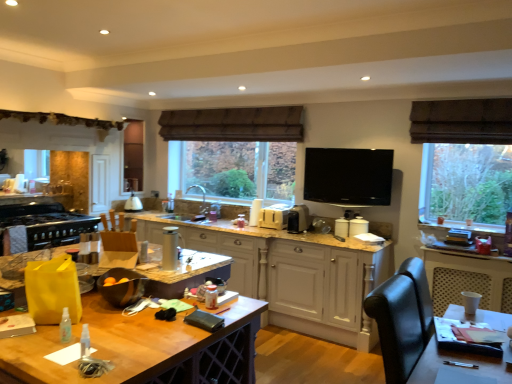
Identify the location of vacant space in front of white plastic toaster at center, which is the third appliance in right-to-left order. pos(271,230).